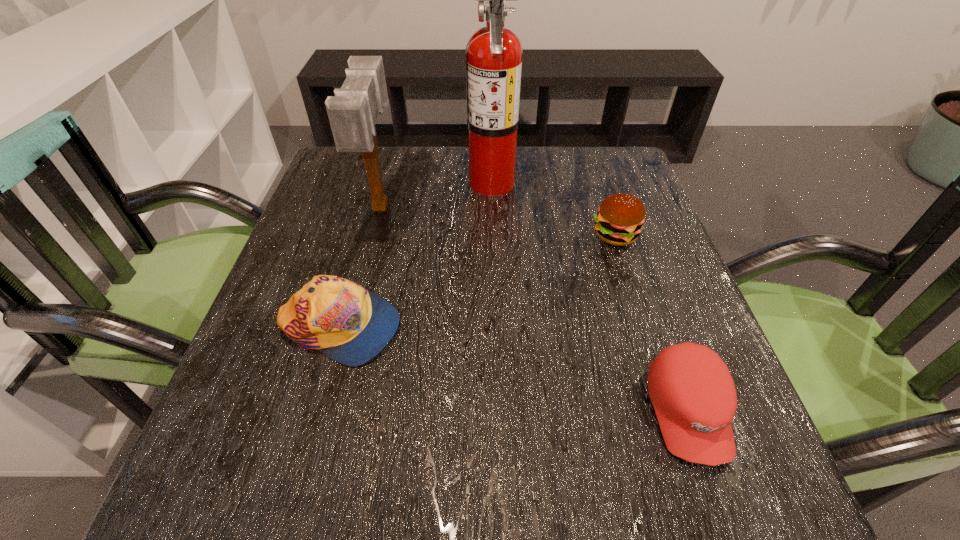
Where is `empty space that is in between the left cap and the hamburger`? Image resolution: width=960 pixels, height=540 pixels. empty space that is in between the left cap and the hamburger is located at coordinates (477, 281).

Where is `free point between the right cap and the mallet`? free point between the right cap and the mallet is located at coordinates (535, 309).

Image resolution: width=960 pixels, height=540 pixels. I want to click on free area in between the hamburger and the third object from right to left, so click(553, 208).

Identify the location of empty space that is in between the hamburger and the right cap. This screenshot has width=960, height=540. (652, 323).

This screenshot has height=540, width=960. Find the location of `blank region between the fire extinguisher and the mallet`. blank region between the fire extinguisher and the mallet is located at coordinates (437, 194).

Where is `free space between the left cap and the tallest object`? This screenshot has height=540, width=960. free space between the left cap and the tallest object is located at coordinates (416, 254).

Find the location of a particular element. empty location between the left cap and the right cap is located at coordinates (514, 369).

The height and width of the screenshot is (540, 960). I want to click on object identified as the second closest to the third object from left to right, so click(x=353, y=111).

Identify which object is the third closest to the left cap. Please provide its 2D coordinates. Your answer should be formatted as a tuple, i.e. [(x, y)], where the tuple contains the x and y coordinates of a point satisfying the conditions above.

[(619, 220)]

The width and height of the screenshot is (960, 540). Identify the location of vacant region that satisfies the following two spatial constraints: 1. on the nozzle side of the tallest object; 2. on the right side of the hamburger. (493, 235).